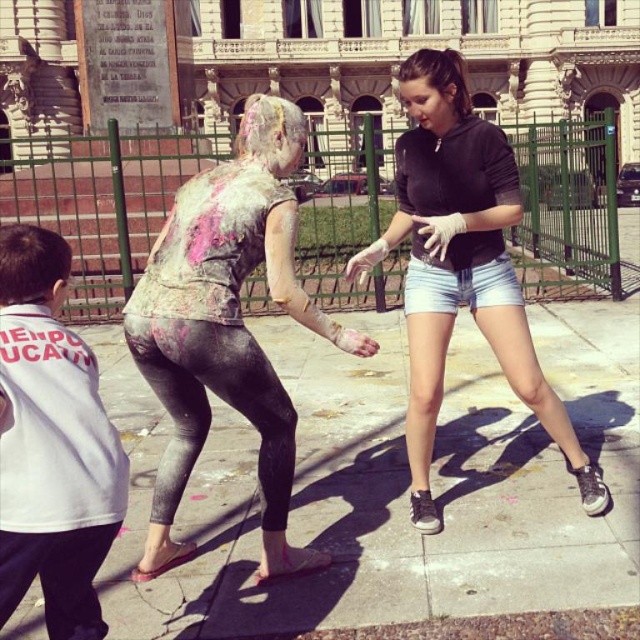
Is point (253, 124) less distant than point (500, 346)?

No.

Image resolution: width=640 pixels, height=640 pixels. Find the location of `painted fabric leggings at center`. painted fabric leggings at center is located at coordinates (227, 326).

Where is `painted fabric leggings at center`? The width and height of the screenshot is (640, 640). painted fabric leggings at center is located at coordinates click(227, 326).

In the scene shown: Measure the distance between concrete sidewalk at center and painted fabric leggings at center.

The distance of concrete sidewalk at center from painted fabric leggings at center is 5.74 meters.

Between concrete sidewalk at center and painted fabric leggings at center, which one has less height?

With less height is concrete sidewalk at center.

The image size is (640, 640). Find the location of `concrete sidewalk at center`. concrete sidewalk at center is located at coordinates [394, 484].

From the picture: Is concrete sidewalk at center thinner than white cotton shirt at left?

No, concrete sidewalk at center is not thinner than white cotton shirt at left.

From the picture: Which of these two, concrete sidewalk at center or white cotton shirt at left, stands taller?

white cotton shirt at left is taller.

Identify the location of concrete sidewalk at center. This screenshot has height=640, width=640. (394, 484).

Identify the location of concrete sidewalk at center. Image resolution: width=640 pixels, height=640 pixels. (394, 484).